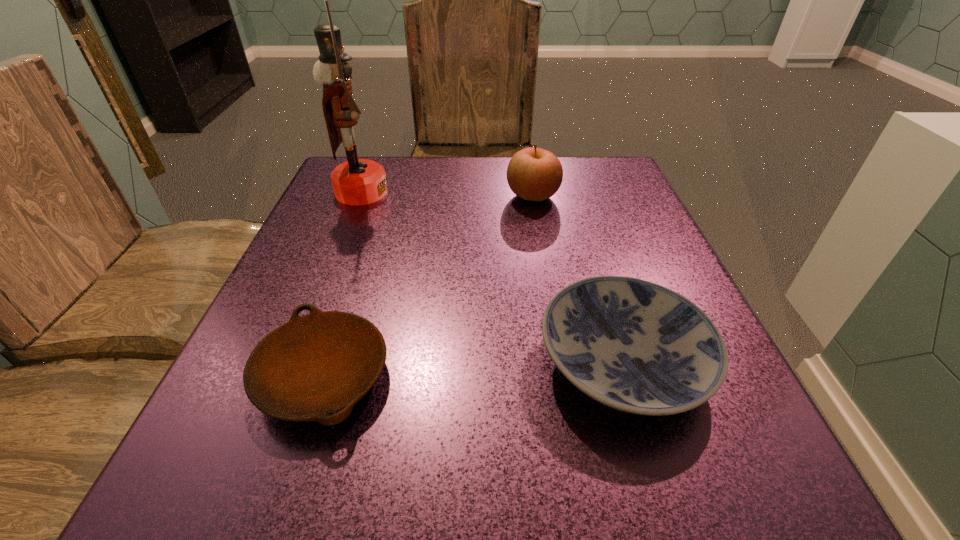
Identify the location of nutcracker positioned at the far edge. This screenshot has height=540, width=960. (357, 181).

Find the location of `apple that is at the far edge`. apple that is at the far edge is located at coordinates (534, 174).

Where is `nutcracker that is positioned at the left edge`? This screenshot has height=540, width=960. nutcracker that is positioned at the left edge is located at coordinates (357, 181).

Locate an element on the screen. The height and width of the screenshot is (540, 960). plate situated at the left edge is located at coordinates (316, 367).

Identify the location of object that is at the right edge. (636, 346).

This screenshot has width=960, height=540. Find the location of `object that is at the far left corner`. object that is at the far left corner is located at coordinates (357, 181).

The height and width of the screenshot is (540, 960). I want to click on free location at the far edge of the desktop, so click(499, 157).

In order to click on free location at the near edge in this screenshot , I will do `click(348, 490)`.

In the image, there is a desktop. Where is `vacant space at the left edge`? vacant space at the left edge is located at coordinates (364, 295).

The image size is (960, 540). I want to click on free location at the right edge of the desktop, so click(x=591, y=251).